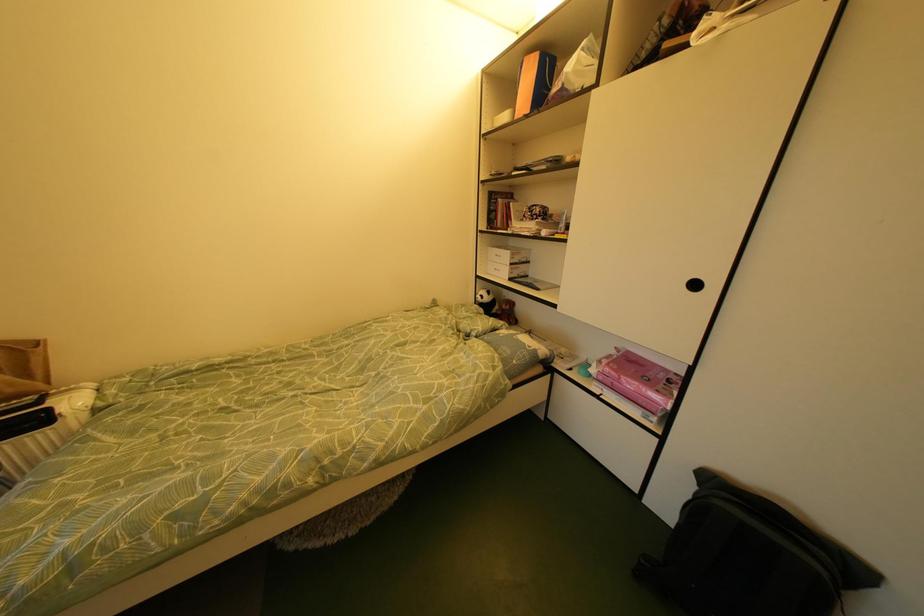
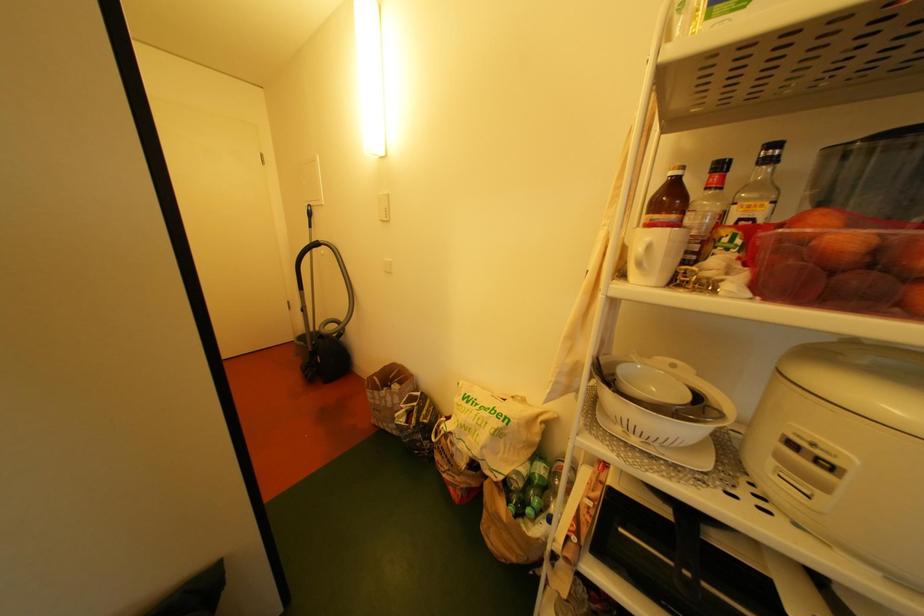
The first image is from the beginning of the video and the second image is from the end. How did the camera likely rotate when shooting the video?

The camera rotated toward right-down.